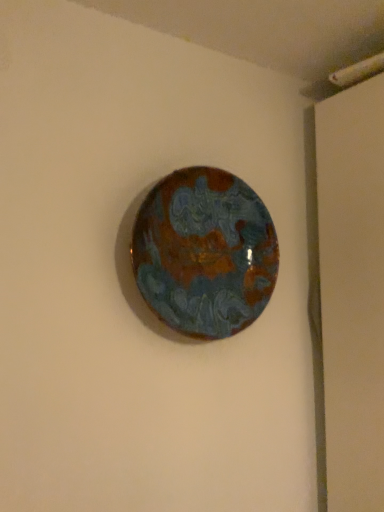
You are a GUI agent. You are given a task and a screenshot of the screen. Output one action in this format:
    pyautogui.click(x=<x>, y=<y>)
    Task: Click on the rusty metallic platter at center
    
    Given the screenshot: What is the action you would take?
    pyautogui.click(x=205, y=253)

Image resolution: width=384 pixels, height=512 pixels. What do you see at coordinates (205, 253) in the screenshot?
I see `rusty metallic platter at center` at bounding box center [205, 253].

In order to face rusty metallic platter at center, should I rotate leftwards or rightwards?

To face it directly, rotate right by 1.845 degrees.

At what (x,y) coordinates should I click in order to perform the action: click on rusty metallic platter at center. Please return your answer as a coordinate pair (x, y). Looking at the image, I should click on (205, 253).